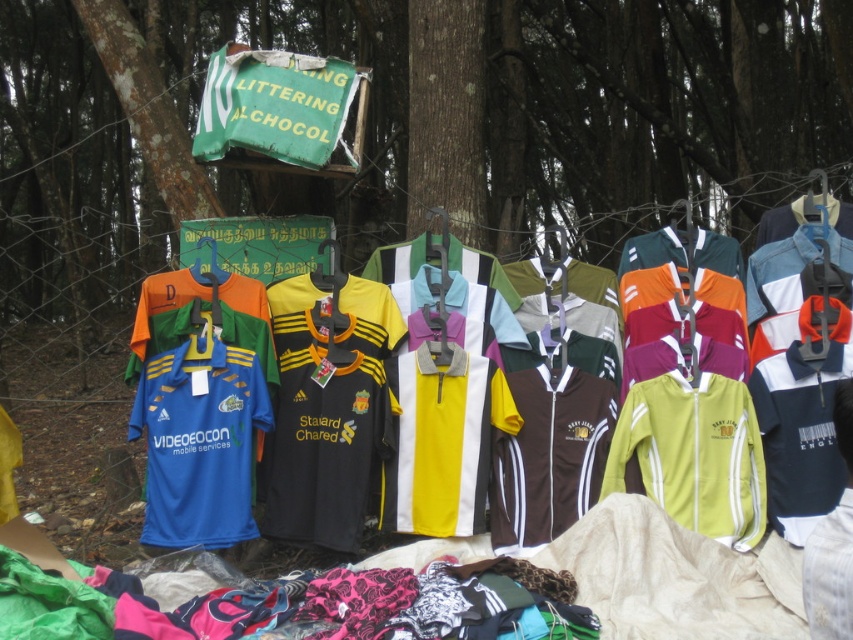
Does smooth bark tree at center have a smaller size compared to yellow polyester jersey at center?

No, smooth bark tree at center is not smaller than yellow polyester jersey at center.

Based on the photo, does smooth bark tree at center appear on the left side of yellow polyester jersey at center?

Indeed, smooth bark tree at center is positioned on the left side of yellow polyester jersey at center.

The image size is (853, 640). What do you see at coordinates (413, 128) in the screenshot? I see `smooth bark tree at center` at bounding box center [413, 128].

This screenshot has width=853, height=640. In order to click on smooth bark tree at center in this screenshot , I will do `click(413, 128)`.

Does yellow polyester jersey at center lie in front of white fabric at center?

No, it is not.

Between point (822, 284) and point (827, 532), which one is positioned in front?

Point (827, 532)

You are a GUI agent. You are given a task and a screenshot of the screen. Output one action in this format:
    pyautogui.click(x=<x>, y=<y>)
    Task: Click on the yellow polyester jersey at center
    
    Given the screenshot: What is the action you would take?
    pyautogui.click(x=822, y=289)

Does smooth bark tree at center have a larger size compared to white fabric at center?

Indeed, smooth bark tree at center has a larger size compared to white fabric at center.

Is point (306, 10) less distant than point (813, 570)?

That is False.

Where is `smooth bark tree at center`? This screenshot has width=853, height=640. smooth bark tree at center is located at coordinates (413, 128).